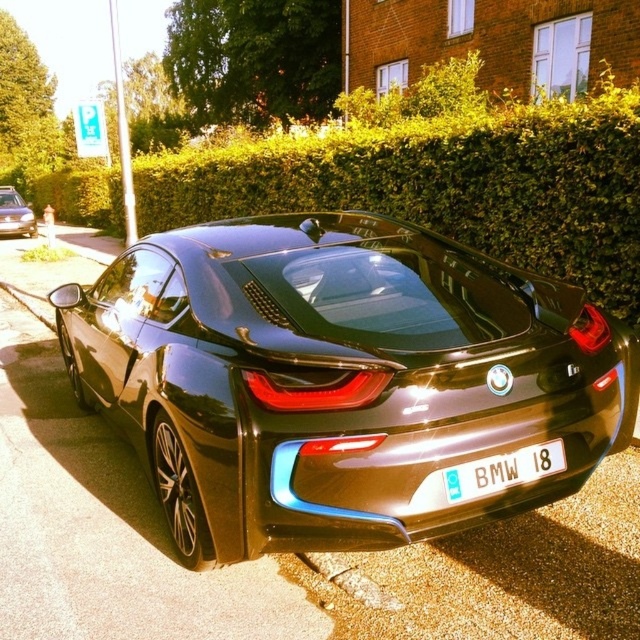
Based on the photo, how far apart are green leafy hedge at upper center and matte black car at left?

green leafy hedge at upper center is 32.75 feet away from matte black car at left.

Which is below, green leafy hedge at upper center or matte black car at left?

matte black car at left is lower down.

Which is behind, point (401, 204) or point (8, 224)?

The point (8, 224) is behind.

I want to click on green leafy hedge at upper center, so click(x=445, y=182).

Can you confirm if white plastic license plate at rear is positioned below concrete at lower left?

Correct, white plastic license plate at rear is located below concrete at lower left.

Can you confirm if white plastic license plate at rear is bigger than concrete at lower left?

No.

The image size is (640, 640). What are the coordinates of `white plastic license plate at rear` in the screenshot? It's located at (502, 472).

Which of these two, green leafy hedge at upper center or concrete at lower left, stands shorter?

concrete at lower left

Which of these two, green leafy hedge at upper center or concrete at lower left, stands taller?

green leafy hedge at upper center is taller.

Which is in front, point (60, 179) or point (6, 288)?

Point (6, 288) is more forward.

The height and width of the screenshot is (640, 640). Find the location of `green leafy hedge at upper center`. green leafy hedge at upper center is located at coordinates [445, 182].